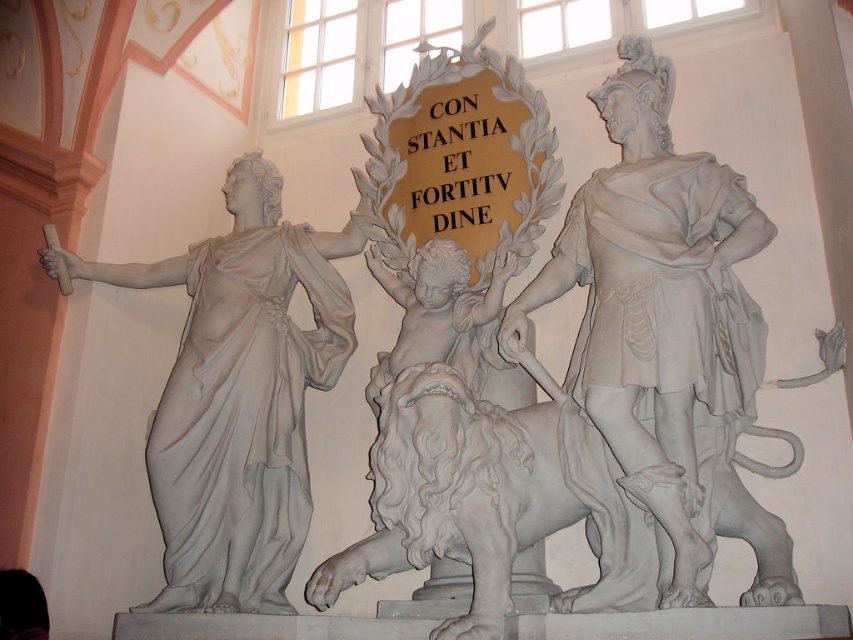
Question: Does white marble statue at right have a larger size compared to white marble statue at left?

Choices:
 (A) no
 (B) yes

Answer: (A)

Question: Which object is farther from the camera taking this photo?

Choices:
 (A) white marble statue at right
 (B) white marble statue at left

Answer: (B)

Question: Which object is closer to the camera taking this photo?

Choices:
 (A) white marble statue at left
 (B) white marble statue at right

Answer: (B)

Question: Does white marble statue at right appear on the left side of white marble statue at left?

Choices:
 (A) no
 (B) yes

Answer: (A)

Question: Which point is closer to the camera taking this photo?

Choices:
 (A) (192, 420)
 (B) (657, 538)

Answer: (B)

Question: Does white marble statue at right appear on the right side of white marble statue at left?

Choices:
 (A) yes
 (B) no

Answer: (A)